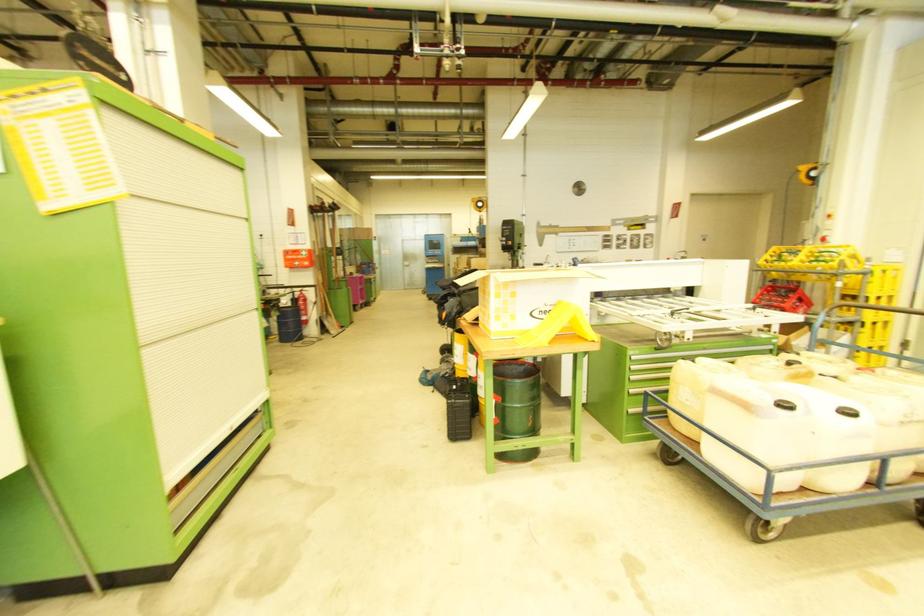
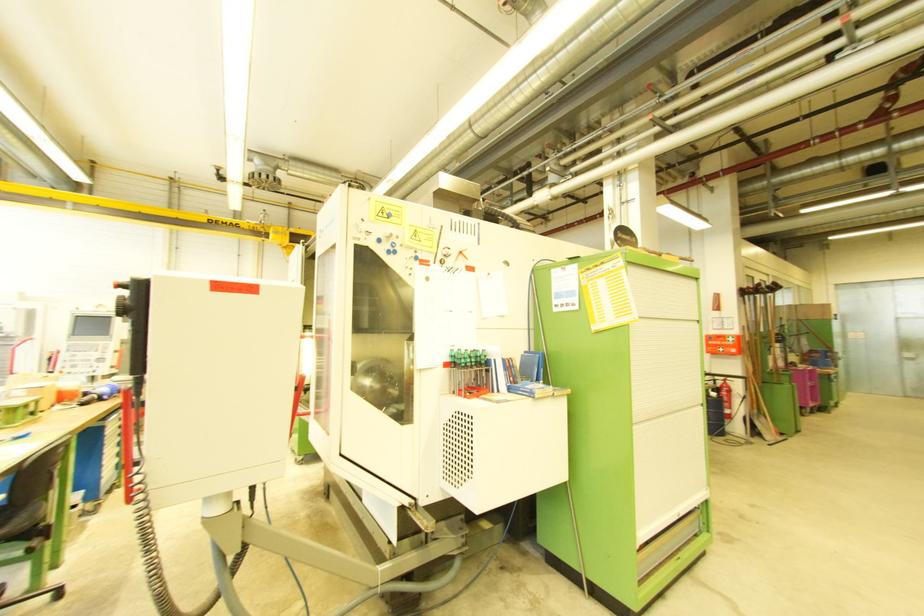
In the second image, find the point that corresponds to point 306,314 in the first image.

(727, 407)